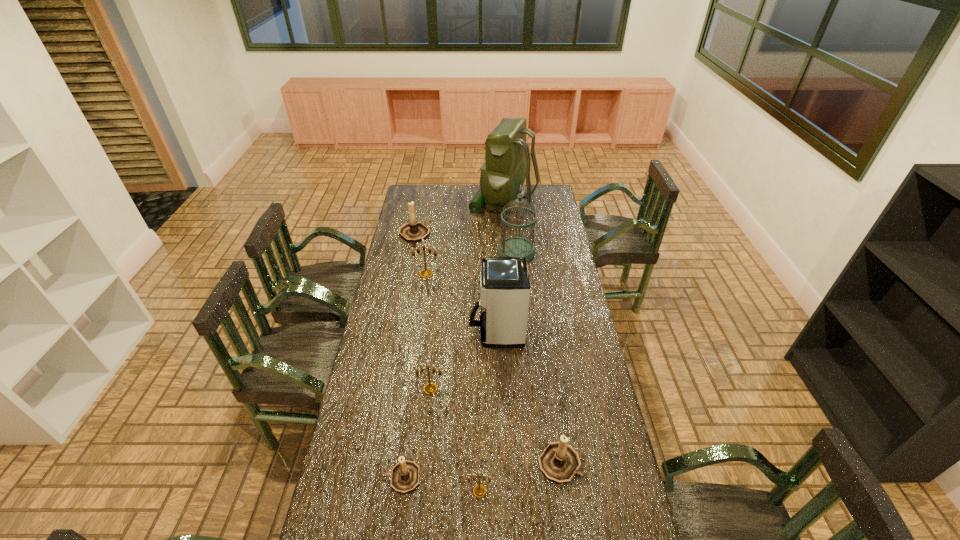
You are a GUI agent. You are given a task and a screenshot of the screen. Output one action in this format:
    pyautogui.click(x=<x>, y=<y>)
    Task: Click on the blank region between the second biggest brown candle holder and the smallest brown candle holder
    
    Given the screenshot: What is the action you would take?
    pyautogui.click(x=481, y=470)

What are the coordinates of `free space between the second candelabrum from right to left and the biggest gold candelabrum` in the screenshot? It's located at (453, 382).

This screenshot has height=540, width=960. Identify the location of free spot between the second smallest brown candle holder and the smallest gold candelabrum. (519, 477).

Identify the location of blank region between the smallest brown candle holder and the farthest candelabrum. The height and width of the screenshot is (540, 960). (409, 355).

Find the location of a particular element. The image size is (960, 540). object that stands as the fifth closest to the coffee maker is located at coordinates (405, 475).

Locate an element on the screen. The width and height of the screenshot is (960, 540). object that is the eighth closest to the birdcage is located at coordinates (479, 490).

Identify which candelabrum is the third nearest to the birdcage. Please provide its 2D coordinates. Your answer should be formatted as a tuple, i.e. [(x, y)], where the tuple contains the x and y coordinates of a point satisfying the conditions above.

[(430, 388)]

Locate which candelabrum ranks fourth in proximity to the coffee maker. Please provide its 2D coordinates. Your answer should be formatted as a tuple, i.e. [(x, y)], where the tuple contains the x and y coordinates of a point satisfying the conditions above.

[(405, 475)]

You are a GUI agent. You are given a task and a screenshot of the screen. Output one action in this format:
    pyautogui.click(x=<x>, y=<y>)
    Task: Click on the brown candle holder that stands as the second closest to the second smallest brown candle holder
    This screenshot has height=540, width=960.
    Given the screenshot: What is the action you would take?
    pyautogui.click(x=413, y=231)

Locate an element on the screen. the closest brown candle holder to the biggest brown candle holder is located at coordinates (405, 475).